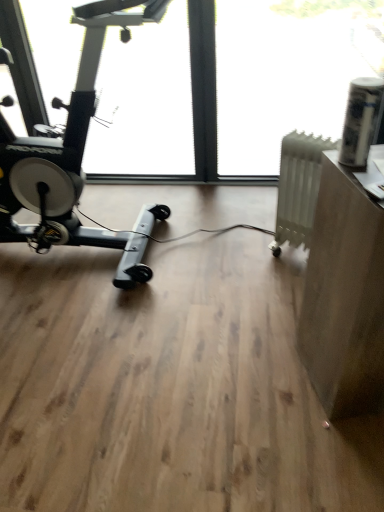
I want to click on space that is in front of white matte radiator at right, so pos(279,289).